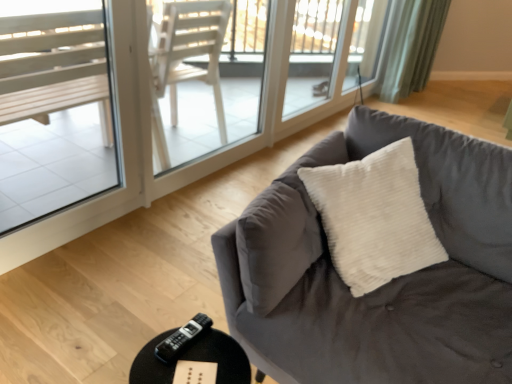
Question: From the image's perspective, is transparent glass window at upper center, placed as the 2th window when sorted from left to right, beneath green fabric curtain at upper right?

Choices:
 (A) no
 (B) yes

Answer: (B)

Question: Can you confirm if transparent glass window at upper center, which ranks as the 1th window in right-to-left order, is thinner than green fabric curtain at upper right?

Choices:
 (A) yes
 (B) no

Answer: (A)

Question: From the image's perspective, is transparent glass window at upper center, placed as the 2th window when sorted from left to right, on top of green fabric curtain at upper right?

Choices:
 (A) no
 (B) yes

Answer: (A)

Question: Considering the relative positions of transparent glass window at upper center, which ranks as the 1th window in right-to-left order, and green fabric curtain at upper right in the image provided, is transparent glass window at upper center, which ranks as the 1th window in right-to-left order, behind green fabric curtain at upper right?

Choices:
 (A) no
 (B) yes

Answer: (A)

Question: From a real-world perspective, is transparent glass window at upper center, which ranks as the 1th window in right-to-left order, physically above green fabric curtain at upper right?

Choices:
 (A) no
 (B) yes

Answer: (B)

Question: Does transparent glass window at upper center, which is the 2th window in front-to-back order, appear on the left side of green fabric curtain at upper right?

Choices:
 (A) no
 (B) yes

Answer: (B)

Question: Is clear glass window at left, which is counted as the first window, starting from the front, shorter than velvet gray couch at center?

Choices:
 (A) yes
 (B) no

Answer: (B)

Question: Is clear glass window at left, which is the first window from bottom to top, far away from velvet gray couch at center?

Choices:
 (A) no
 (B) yes

Answer: (B)

Question: Is clear glass window at left, marked as the second window in a right-to-left arrangement, oriented towards velvet gray couch at center?

Choices:
 (A) yes
 (B) no

Answer: (A)

Question: From the image's perspective, is clear glass window at left, marked as the second window in a right-to-left arrangement, above velvet gray couch at center?

Choices:
 (A) yes
 (B) no

Answer: (A)

Question: Does clear glass window at left, which is the first window from bottom to top, touch velvet gray couch at center?

Choices:
 (A) no
 (B) yes

Answer: (A)

Question: From a real-world perspective, is clear glass window at left, marked as the 2th window in a back-to-front arrangement, beneath velvet gray couch at center?

Choices:
 (A) yes
 (B) no

Answer: (B)

Question: Are transparent glass screen door at upper center, the 1th screen door positioned from the right, and transparent glass window at upper center, the first window when ordered from top to bottom, beside each other?

Choices:
 (A) yes
 (B) no

Answer: (B)